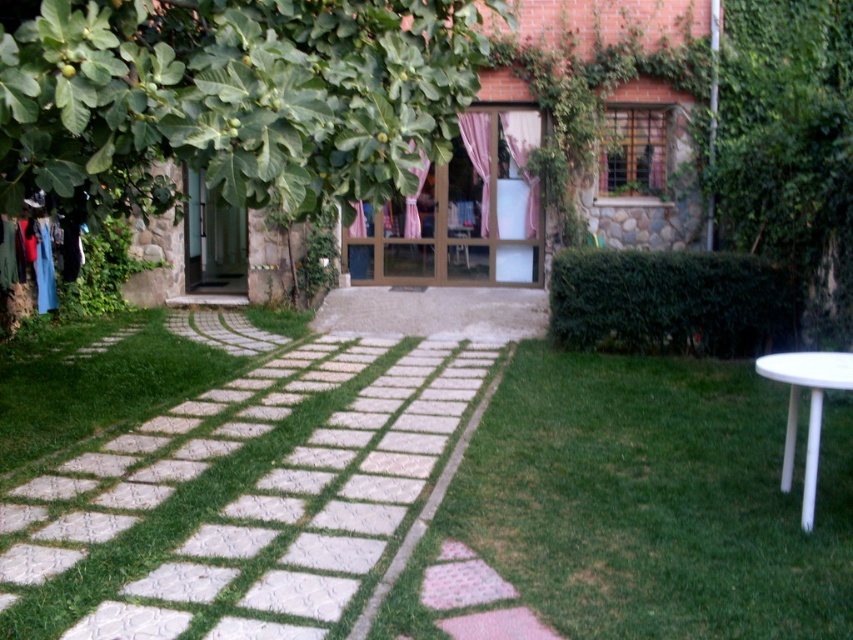
You are standing at the entrance of the garden and see two points marked in the scene. The first point is at coordinate point [758,371] and the second is at point [421,234]. If you want to walk towards the house, which point should you aim for first?

Point [758,371] is in front of point [421,234], so you should aim for point [758,371] first as it is closer to your current position at the entrance.

You are planning to set up a small tea station in the garden. You have a white plastic table at right and a pink fabric curtain at center. Which object should you use if you need a surface to place tea cups and why?

The white plastic table at right should be used because it is a surface designed for placing items, unlike the pink fabric curtain at center which is a hanging decorative item.